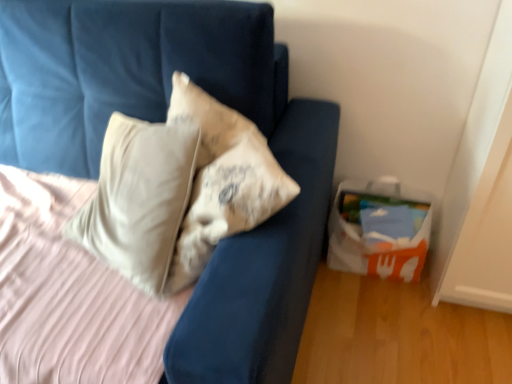
Question: Is velvet blue sofa at upper left turned away from white paper bag at lower right?

Choices:
 (A) no
 (B) yes

Answer: (A)

Question: Considering the relative sizes of velvet blue sofa at upper left and white paper bag at lower right in the image provided, is velvet blue sofa at upper left smaller than white paper bag at lower right?

Choices:
 (A) no
 (B) yes

Answer: (A)

Question: Does velvet blue sofa at upper left have a lesser width compared to white paper bag at lower right?

Choices:
 (A) no
 (B) yes

Answer: (A)

Question: Does velvet blue sofa at upper left turn towards white paper bag at lower right?

Choices:
 (A) no
 (B) yes

Answer: (A)

Question: Does velvet blue sofa at upper left lie behind white paper bag at lower right?

Choices:
 (A) no
 (B) yes

Answer: (A)

Question: Does velvet blue sofa at upper left have a greater height compared to white paper bag at lower right?

Choices:
 (A) yes
 (B) no

Answer: (A)

Question: Is white paper bag at lower right behind velvet blue sofa at upper left?

Choices:
 (A) no
 (B) yes

Answer: (B)

Question: Does white paper bag at lower right turn towards velvet blue sofa at upper left?

Choices:
 (A) yes
 (B) no

Answer: (B)

Question: Is white paper bag at lower right placed right next to velvet blue sofa at upper left?

Choices:
 (A) no
 (B) yes

Answer: (A)

Question: Is white paper bag at lower right facing away from velvet blue sofa at upper left?

Choices:
 (A) yes
 (B) no

Answer: (B)

Question: Is white paper bag at lower right positioned far away from velvet blue sofa at upper left?

Choices:
 (A) no
 (B) yes

Answer: (A)

Question: From the image's perspective, does white paper bag at lower right appear lower than velvet blue sofa at upper left?

Choices:
 (A) yes
 (B) no

Answer: (A)

Question: Looking at the image, does white paper bag at lower right seem bigger or smaller compared to velvet blue sofa at upper left?

Choices:
 (A) small
 (B) big

Answer: (A)